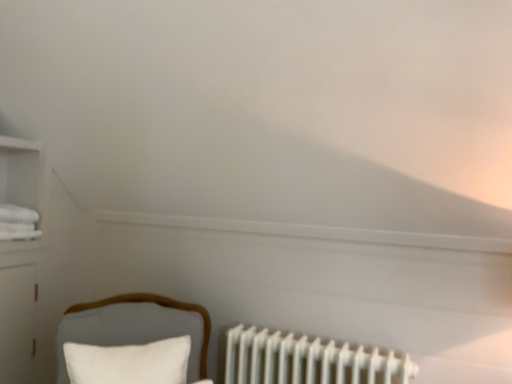
Question: From the image's perspective, is white matte radiator at lower right on top of white soft pillow at lower left?

Choices:
 (A) no
 (B) yes

Answer: (A)

Question: Is white matte radiator at lower right facing away from white soft pillow at lower left?

Choices:
 (A) yes
 (B) no

Answer: (B)

Question: Does white matte radiator at lower right contain white soft pillow at lower left?

Choices:
 (A) yes
 (B) no

Answer: (B)

Question: Is white matte radiator at lower right further to camera compared to white soft pillow at lower left?

Choices:
 (A) yes
 (B) no

Answer: (A)

Question: Are white matte radiator at lower right and white soft pillow at lower left far apart?

Choices:
 (A) yes
 (B) no

Answer: (B)

Question: From the image's perspective, relative to velvet white chair at lower left, is white soft pillow at lower left above or below?

Choices:
 (A) below
 (B) above

Answer: (B)

Question: From a real-world perspective, is white soft pillow at lower left above or below velvet white chair at lower left?

Choices:
 (A) above
 (B) below

Answer: (A)

Question: Is white soft pillow at lower left to the left or to the right of velvet white chair at lower left in the image?

Choices:
 (A) left
 (B) right

Answer: (A)

Question: Is white soft pillow at lower left bigger or smaller than velvet white chair at lower left?

Choices:
 (A) big
 (B) small

Answer: (B)

Question: Would you say velvet white chair at lower left is inside or outside white soft pillow at lower left?

Choices:
 (A) inside
 (B) outside

Answer: (B)

Question: Is velvet white chair at lower left in front of or behind white soft pillow at lower left in the image?

Choices:
 (A) front
 (B) behind

Answer: (A)

Question: In the image, is velvet white chair at lower left on the left side or the right side of white soft pillow at lower left?

Choices:
 (A) right
 (B) left

Answer: (A)

Question: From the image's perspective, relative to white soft pillow at lower left, is velvet white chair at lower left above or below?

Choices:
 (A) above
 (B) below

Answer: (B)

Question: Looking at their shapes, would you say white soft pillow at lower left is wider or thinner than white matte radiator at lower right?

Choices:
 (A) thin
 (B) wide

Answer: (A)

Question: Looking at the image, does white soft pillow at lower left seem bigger or smaller compared to white matte radiator at lower right?

Choices:
 (A) big
 (B) small

Answer: (B)